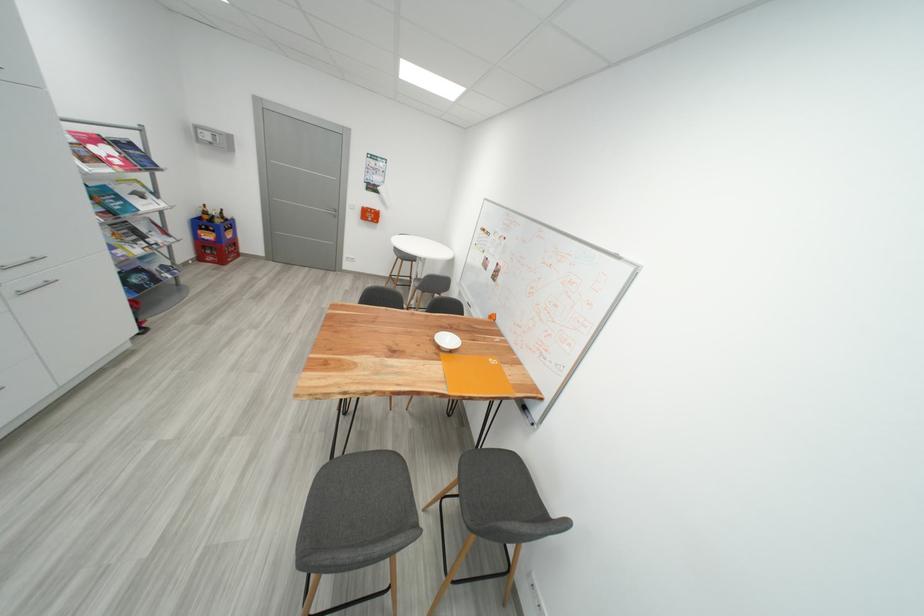
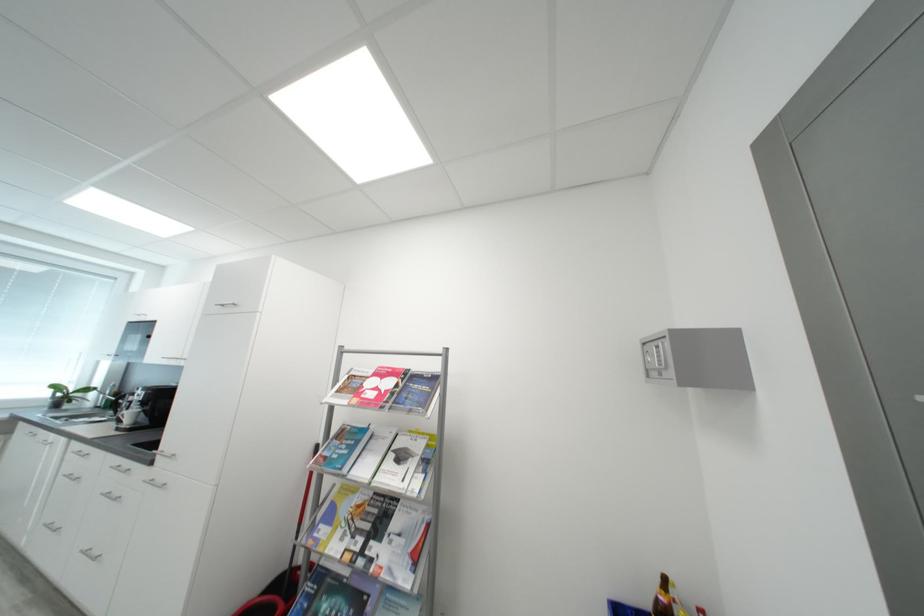
Locate, in the second image, the point that corresponds to the point at 157,243 in the first image.

(380, 549)